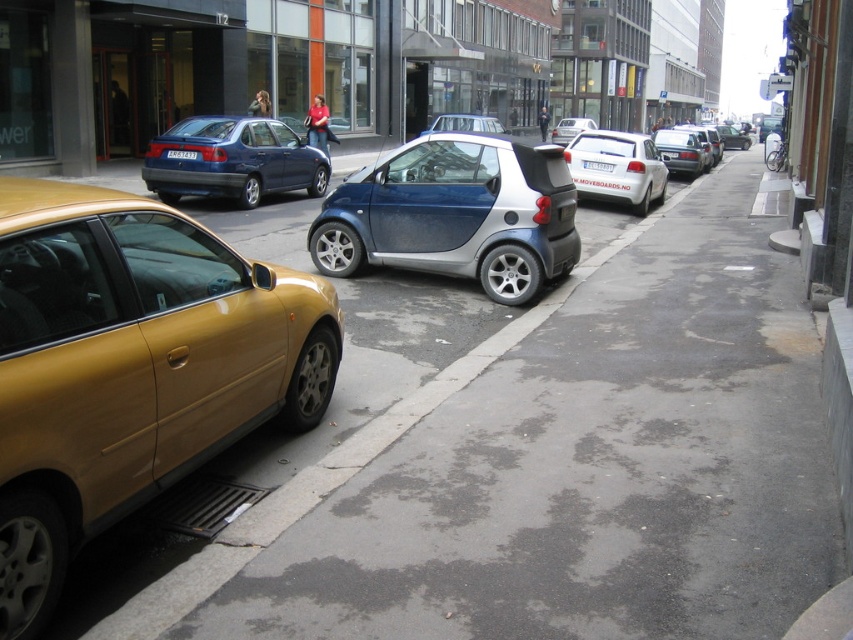
Question: Which point appears farthest from the camera in this image?

Choices:
 (A) (500, 125)
 (B) (4, 369)

Answer: (A)

Question: Which of the following is the farthest from the observer?

Choices:
 (A) metallic blue hatchback at center
 (B) white plastic license plate at center
 (C) black plastic license plate at center
 (D) metallic blue car at center

Answer: (A)

Question: Is matte blue sedan at center to the right of black plastic license plate at center from the viewer's perspective?

Choices:
 (A) no
 (B) yes

Answer: (B)

Question: Is white matte hatchback at center smaller than metallic blue hatchback at center?

Choices:
 (A) yes
 (B) no

Answer: (B)

Question: Can you confirm if dark gray asphalt at center is bigger than black plastic license plate at center?

Choices:
 (A) yes
 (B) no

Answer: (A)

Question: Which point is closer to the camera?

Choices:
 (A) metallic blue sedan at center
 (B) gold metallic sedan at lower left
 (C) dark gray asphalt at center
 (D) metallic blue car at center

Answer: (B)